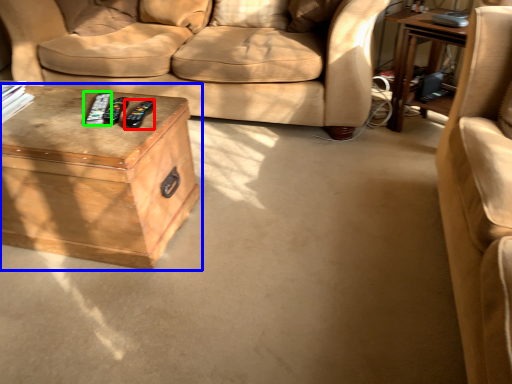
Question: Based on their relative distances, which object is nearer to remote (highlighted by a red box)? Choose from table (highlighted by a blue box) and remote (highlighted by a green box).

Choices:
 (A) table
 (B) remote

Answer: (B)